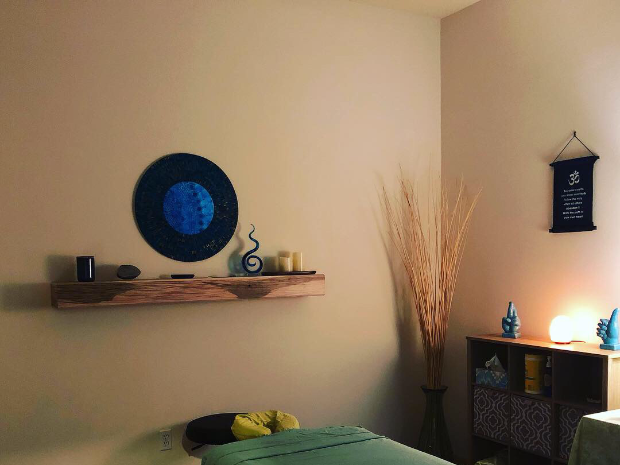
I want to click on unlit candles, so click(x=284, y=268), click(x=286, y=257), click(x=299, y=256).